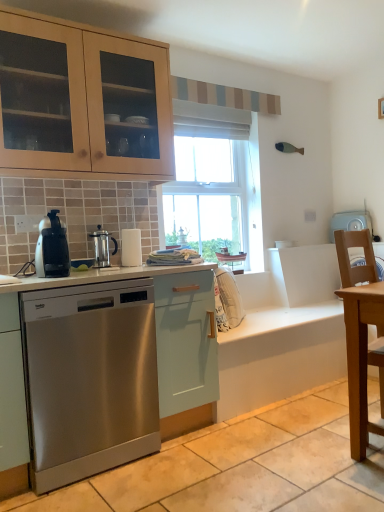
Question: In the image, is satin black coffee maker at left positioned in front of or behind satin silver coffee press at center?

Choices:
 (A) front
 (B) behind

Answer: (A)

Question: From a real-world perspective, relative to satin silver coffee press at center, is satin black coffee maker at left vertically above or below?

Choices:
 (A) above
 (B) below

Answer: (A)

Question: Considering the real-world distances, which object is closest to the satin silver coffee press at center?

Choices:
 (A) stainless steel dishwasher at left
 (B) light brown wooden table at right
 (C) satin black coffee maker at left
 (D) light blue plastic washing machine at right

Answer: (C)

Question: Considering the real-world distances, which object is farthest from the stainless steel dishwasher at left?

Choices:
 (A) light blue plastic washing machine at right
 (B) satin silver coffee press at center
 (C) light brown wooden table at right
 (D) satin black coffee maker at left

Answer: (A)